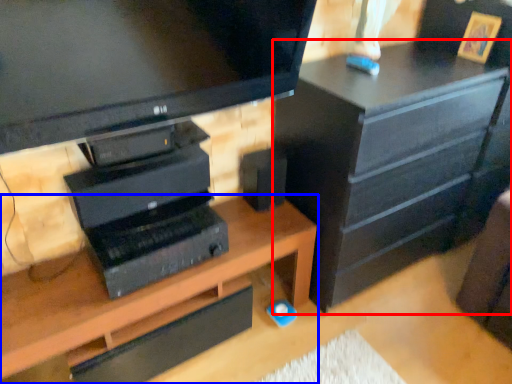
Question: Which of the following is the farthest to the observer, chest of drawers (highlighted by a red box) or desk (highlighted by a blue box)?

Choices:
 (A) chest of drawers
 (B) desk

Answer: (A)